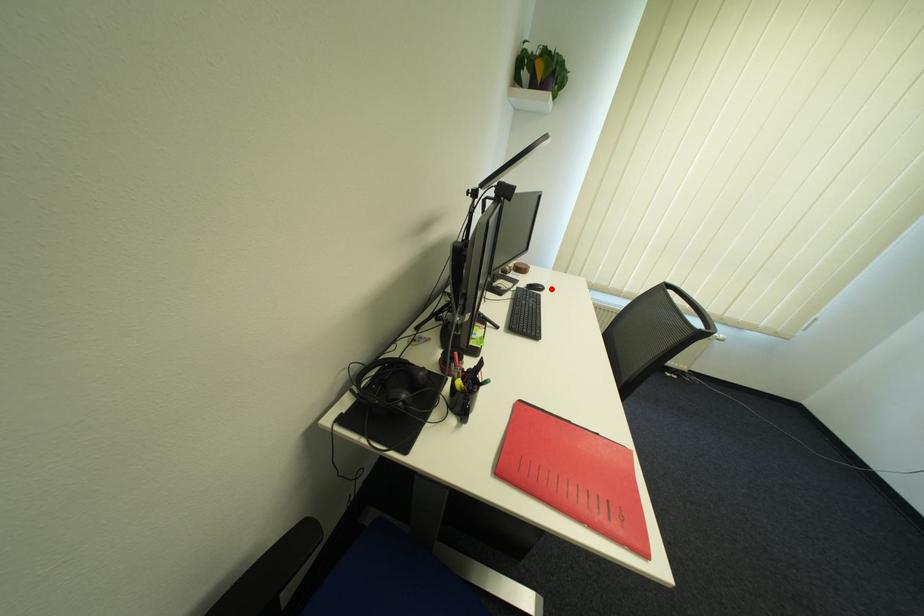
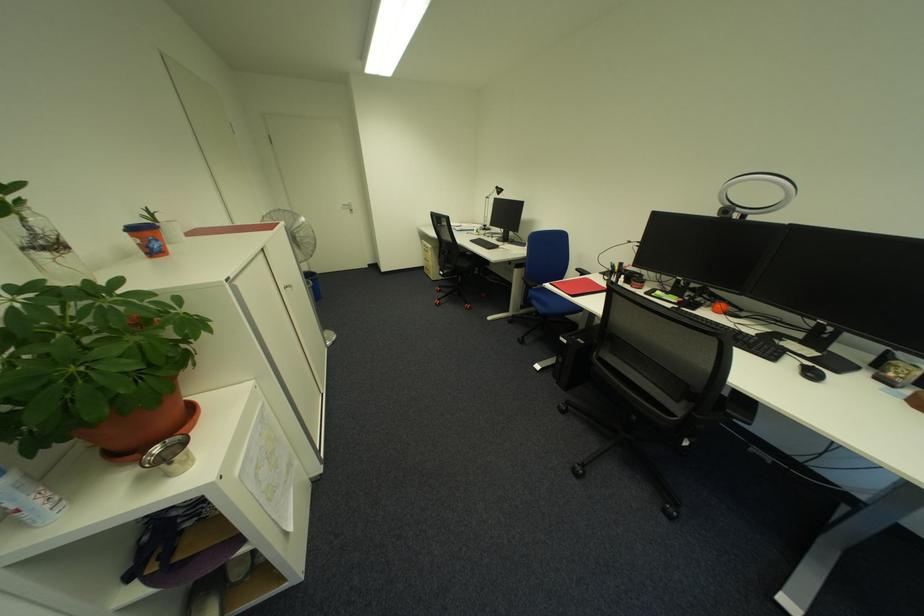
Where in the second image is the point corresponding to the highlighted location from the first image?

(820, 376)